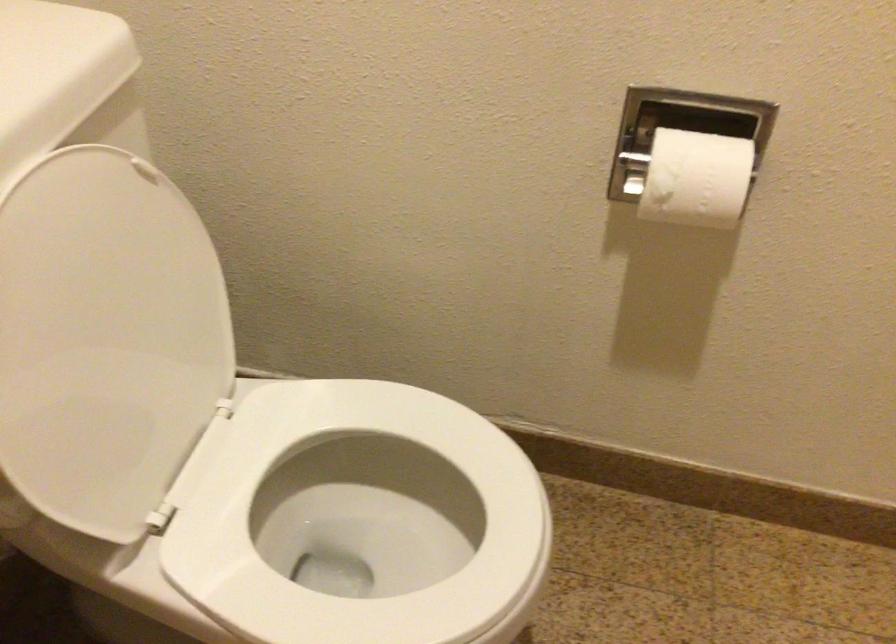
Where is `white toilet paper roll`? The height and width of the screenshot is (644, 896). white toilet paper roll is located at coordinates 695,178.